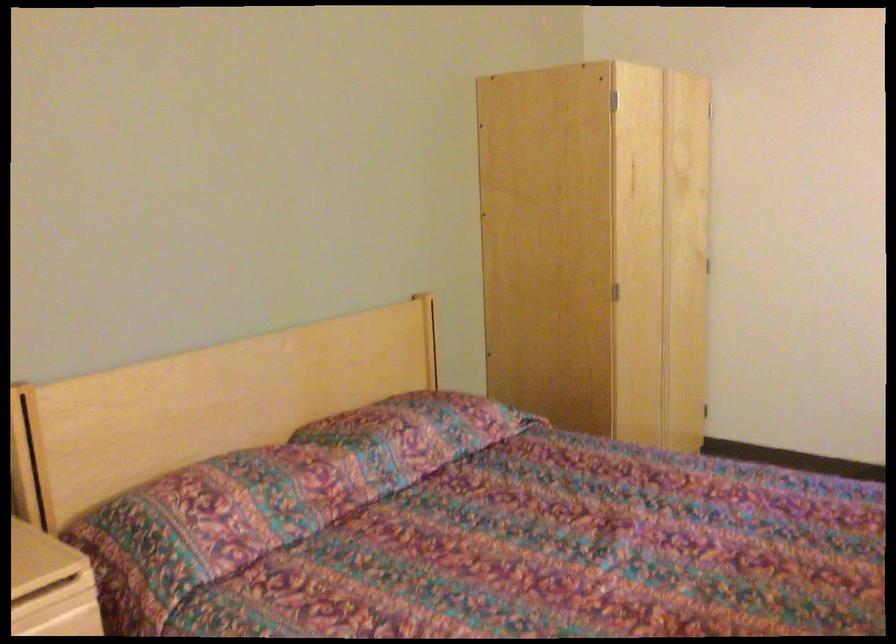
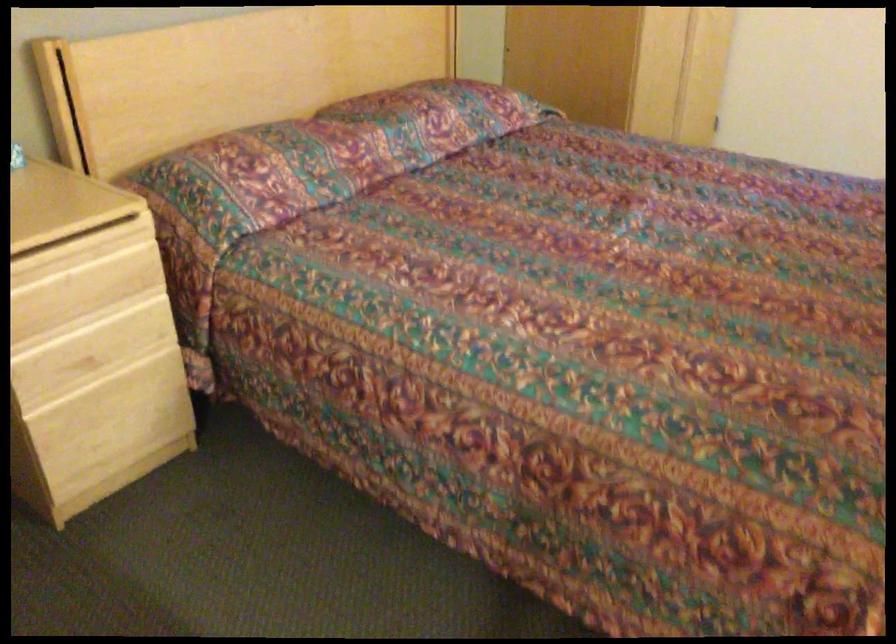
Question: The images are taken continuously from a first-person perspective. In which direction is your viewpoint rotating?

Choices:
 (A) Left
 (B) Right
 (C) Up
 (D) Down

Answer: (D)